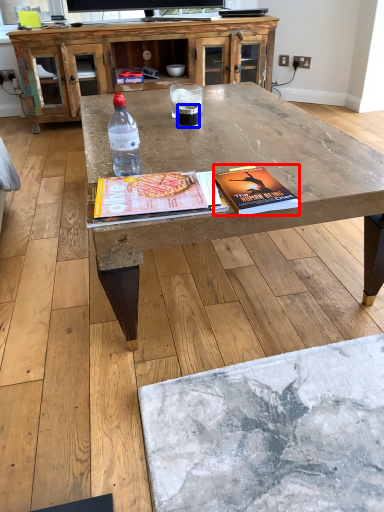
Question: Which point is further to the camera, paperback book (highlighted by a red box) or beverage (highlighted by a blue box)?

Choices:
 (A) paperback book
 (B) beverage

Answer: (B)